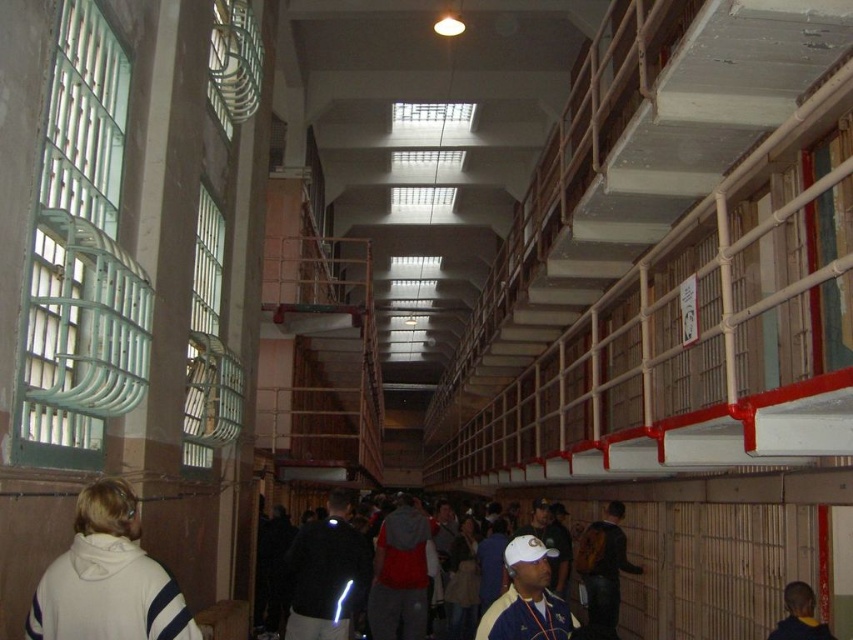
Question: Can you confirm if red fabric jacket at center is wider than dark blue hoodie at lower right?

Choices:
 (A) yes
 (B) no

Answer: (A)

Question: Which point appears closest to the camera in this image?

Choices:
 (A) (398, 580)
 (B) (589, 540)
 (C) (553, 627)

Answer: (C)

Question: Which point is farther to the camera?

Choices:
 (A) red fabric jacket at center
 (B) matte brown backpack at lower center
 (C) dark blue hoodie at lower right

Answer: (A)

Question: From the image, what is the correct spatial relationship of white matte baseball cap at center in relation to dark blue hoodie at lower right?

Choices:
 (A) below
 (B) above

Answer: (A)

Question: Considering the real-world distances, which object is closest to the red fabric jacket at center?

Choices:
 (A) white fleece jacket at lower left
 (B) dark blue hoodie at lower right

Answer: (B)

Question: Does white matte baseball cap at center have a smaller size compared to dark gray fabric jacket at center?

Choices:
 (A) no
 (B) yes

Answer: (B)